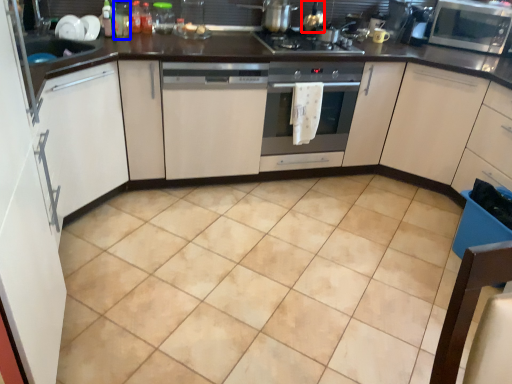
Question: Which point is further to the camera, appliance (highlighted by a red box) or bottle (highlighted by a blue box)?

Choices:
 (A) appliance
 (B) bottle

Answer: (A)